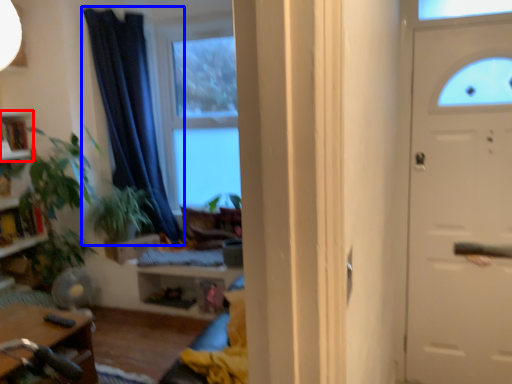
Question: Among these objects, which one is nearest to the camera, shelf (highlighted by a red box) or curtain (highlighted by a blue box)?

Choices:
 (A) shelf
 (B) curtain

Answer: (B)